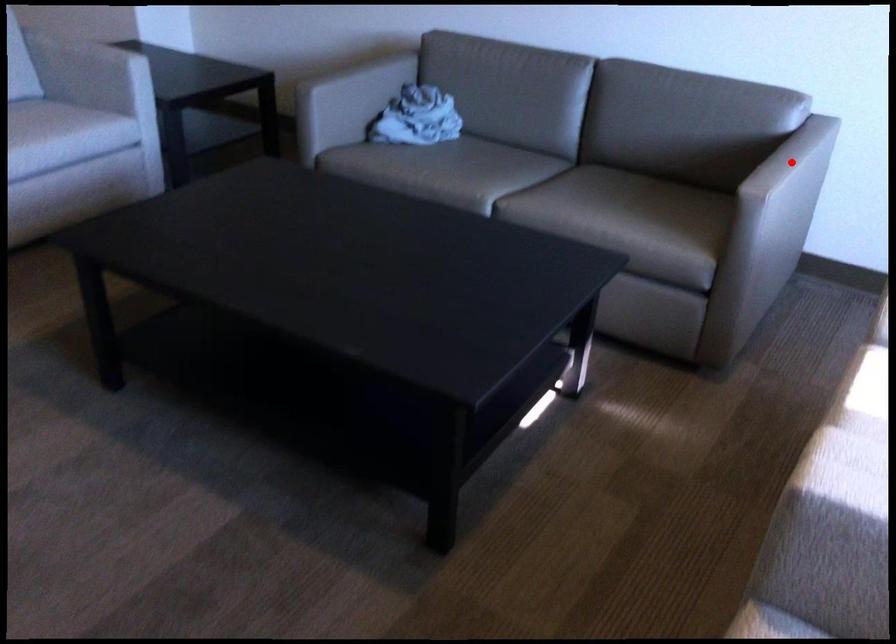
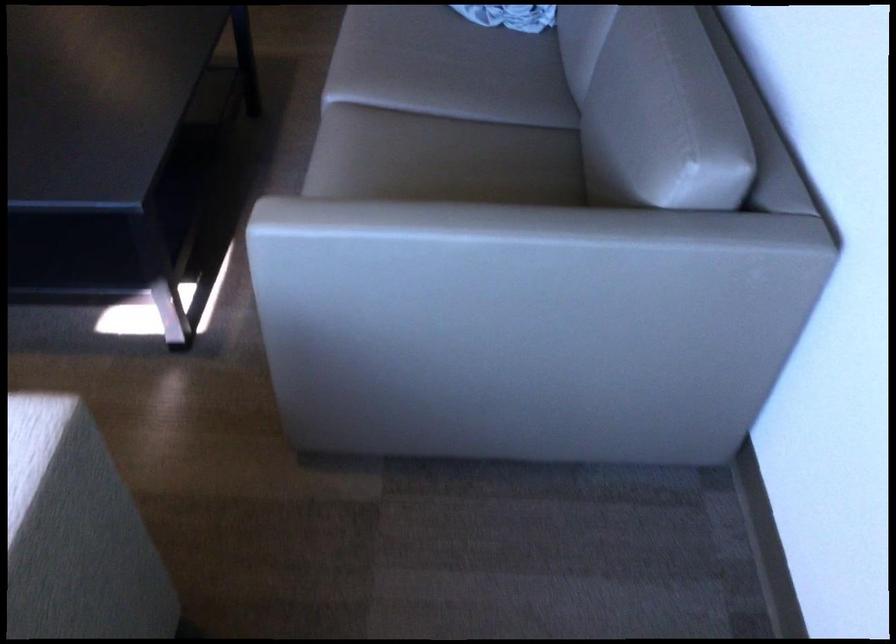
Locate, in the second image, the point that corresponds to the highlighted location in the first image.

(485, 249)